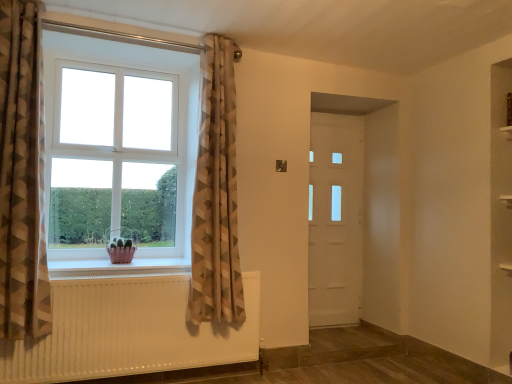
Question: Considering the relative sizes of white plastic window at left and white textured radiator at lower left in the image provided, is white plastic window at left shorter than white textured radiator at lower left?

Choices:
 (A) no
 (B) yes

Answer: (A)

Question: Can you confirm if white plastic window at left is wider than white textured radiator at lower left?

Choices:
 (A) yes
 (B) no

Answer: (A)

Question: Is white plastic window at left taller than white textured radiator at lower left?

Choices:
 (A) yes
 (B) no

Answer: (A)

Question: From the image's perspective, would you say white plastic window at left is positioned over white textured radiator at lower left?

Choices:
 (A) yes
 (B) no

Answer: (A)

Question: From the image's perspective, does white plastic window at left appear lower than white textured radiator at lower left?

Choices:
 (A) no
 (B) yes

Answer: (A)

Question: From the image's perspective, relative to brown geometric fabric curtain at left, the 1th curtain in the left-to-right sequence, is white plastic window at left above or below?

Choices:
 (A) above
 (B) below

Answer: (A)

Question: Looking at their shapes, would you say white plastic window at left is wider or thinner than brown geometric fabric curtain at left, the 1th curtain in the left-to-right sequence?

Choices:
 (A) thin
 (B) wide

Answer: (A)

Question: Considering the relative positions of white plastic window at left and brown geometric fabric curtain at left, arranged as the 1th curtain when viewed from the front, in the image provided, is white plastic window at left to the left or to the right of brown geometric fabric curtain at left, arranged as the 1th curtain when viewed from the front,?

Choices:
 (A) left
 (B) right

Answer: (B)

Question: Relative to brown geometric fabric curtain at left, which appears as the 2th curtain when viewed from the right, is white plastic window at left in front or behind?

Choices:
 (A) behind
 (B) front

Answer: (A)

Question: In terms of width, does white plastic window at left look wider or thinner when compared to white textured radiator at lower left?

Choices:
 (A) wide
 (B) thin

Answer: (A)

Question: From a real-world perspective, is white plastic window at left above or below white textured radiator at lower left?

Choices:
 (A) below
 (B) above

Answer: (B)

Question: In the image, is white plastic window at left on the left side or the right side of white textured radiator at lower left?

Choices:
 (A) right
 (B) left

Answer: (B)

Question: Looking at the image, does white plastic window at left seem bigger or smaller compared to white textured radiator at lower left?

Choices:
 (A) big
 (B) small

Answer: (A)

Question: Is white plastic window at left inside the boundaries of neutral geometric fabric curtain at upper left, which ranks as the second curtain in left-to-right order, or outside?

Choices:
 (A) inside
 (B) outside

Answer: (B)

Question: From a real-world perspective, is white plastic window at left physically located above or below neutral geometric fabric curtain at upper left, which is the 2th curtain in front-to-back order?

Choices:
 (A) above
 (B) below

Answer: (A)